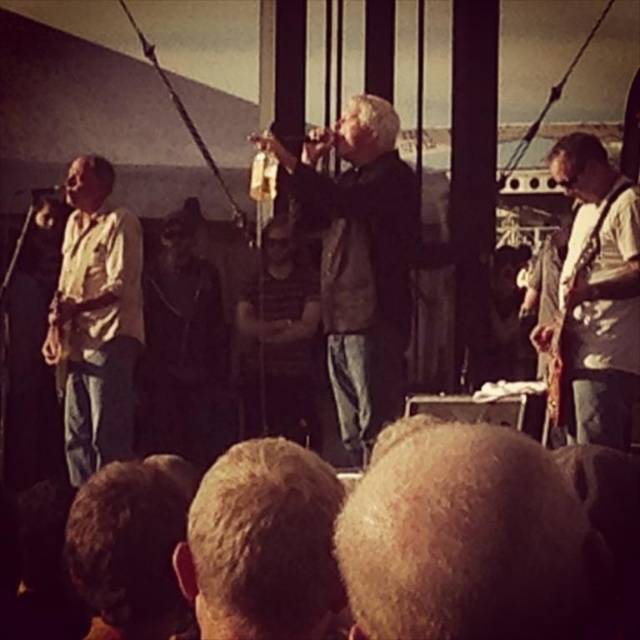
You are standing at the point labeled as point (307,317) and want to move to the stage area. Is the point labeled point (400,164) between you and the stage?

Yes, the point labeled point (400,164) is between you and the stage because it is in front of point (307,317) where you are standing.

You are a photographer trying to capture a clear shot of the light brown hair at center and the dark matte jacket at center during the performance. Which object should you focus on first to ensure it appears sharp in the photo?

The light brown hair at center is larger in size than the dark matte jacket at center, so you should focus on the light brown hair at center first to ensure it appears sharp in the photo.